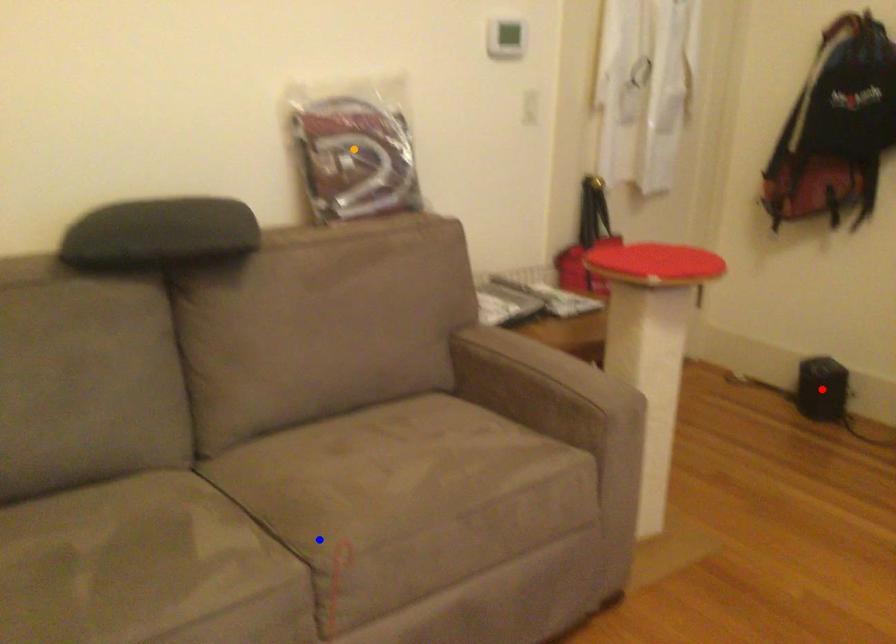
Order these from nearest to farthest:
1. blue point
2. orange point
3. red point

blue point → orange point → red point